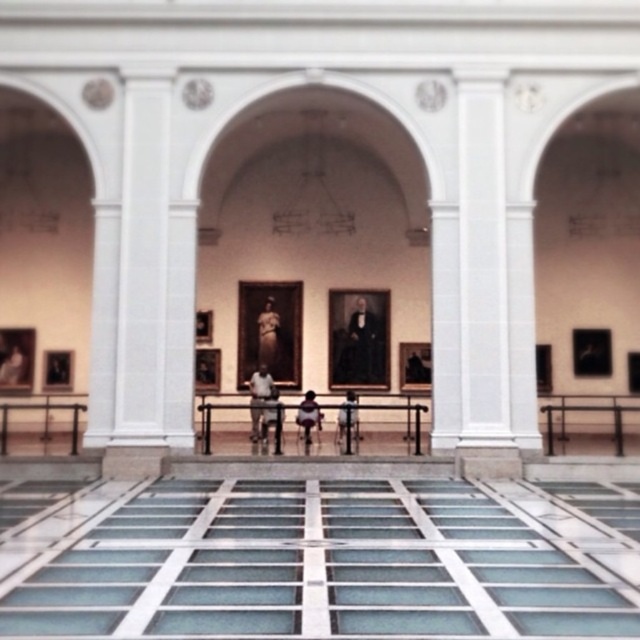
Between smooth black portrait at center and silhouette fabric child at center, which one appears on the right side from the viewer's perspective?

Positioned to the right is smooth black portrait at center.

Is smooth black portrait at center taller than silhouette fabric child at center?

Yes.

Locate an element on the screen. The height and width of the screenshot is (640, 640). smooth black portrait at center is located at coordinates (364, 344).

You are a GUI agent. You are given a task and a screenshot of the screen. Output one action in this format:
    pyautogui.click(x=<x>, y=<y>)
    Task: Click on the smooth black portrait at center
    
    Given the screenshot: What is the action you would take?
    pyautogui.click(x=364, y=344)

Between point (266, 333) and point (314, 392), which one is positioned in front?

Point (314, 392) is more forward.

Who is more distant from viewer, (x=273, y=340) or (x=301, y=419)?

Point (x=273, y=340)

Where is `matte gold statue at center`? matte gold statue at center is located at coordinates (268, 337).

Does smooth black portrait at center have a lesser width compared to dark brown leather jacket at center?

No, smooth black portrait at center is not thinner than dark brown leather jacket at center.

Is point (358, 339) in front of point (339, 433)?

No, (358, 339) is further to viewer.

Measure the distance between point (378,371) and camera.

72.89 feet

This screenshot has width=640, height=640. Identify the location of smooth black portrait at center. (364, 344).